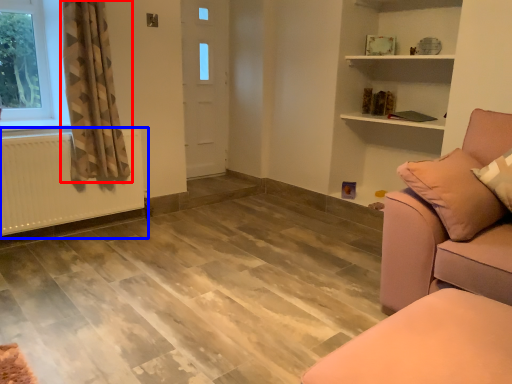
Question: Among these objects, which one is nearest to the camera, curtain (highlighted by a red box) or radiator (highlighted by a blue box)?

Choices:
 (A) curtain
 (B) radiator

Answer: (A)